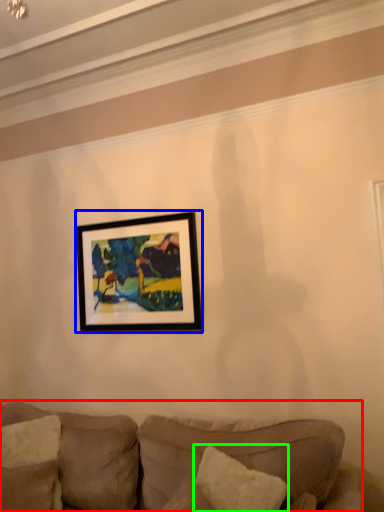
Question: Estimate the real-world distances between objects in this image. Which object is farther from studio couch (highlighted by a red box), picture frame (highlighted by a blue box) or pillow (highlighted by a green box)?

Choices:
 (A) picture frame
 (B) pillow

Answer: (A)